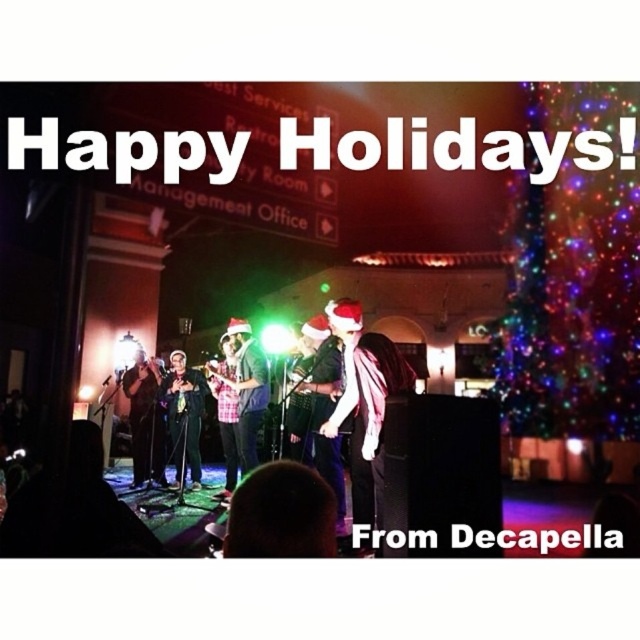
Does point (388, 342) lie in front of point (173, 404)?

Yes, point (388, 342) is closer to viewer.

The height and width of the screenshot is (640, 640). Describe the element at coordinates (364, 401) in the screenshot. I see `matte black shirt at center` at that location.

Find the location of `matte black shirt at center`. matte black shirt at center is located at coordinates (364, 401).

Who is higher up, plaid fabric shirt at center or shiny black microphone at center?

plaid fabric shirt at center is above.

Who is more distant from viewer, (x=241, y=433) or (x=145, y=456)?

The point (x=145, y=456) is behind.

Describe the element at coordinates (244, 388) in the screenshot. I see `plaid fabric shirt at center` at that location.

Locate an element on the screen. This screenshot has height=640, width=640. plaid fabric shirt at center is located at coordinates (244, 388).

Which is behind, point (246, 364) or point (168, 410)?

The point (168, 410) is more distant.

Which of these two, plaid fabric shirt at center or shiny black suit at center, stands shorter?

Standing shorter between the two is shiny black suit at center.

Describe the element at coordinates (244, 388) in the screenshot. The height and width of the screenshot is (640, 640). I see `plaid fabric shirt at center` at that location.

In order to click on plaid fabric shirt at center in this screenshot , I will do `click(244, 388)`.